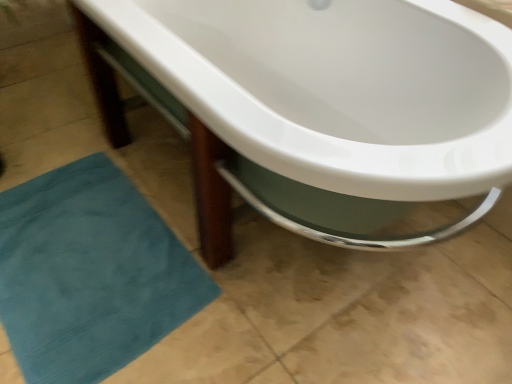
What do you see at coordinates (90, 273) in the screenshot? The image size is (512, 384). I see `teal plush bath mat at lower left` at bounding box center [90, 273].

Locate an element on the screen. This screenshot has height=384, width=512. teal plush bath mat at lower left is located at coordinates (90, 273).

The image size is (512, 384). In order to click on teal plush bath mat at lower left in this screenshot , I will do `click(90, 273)`.